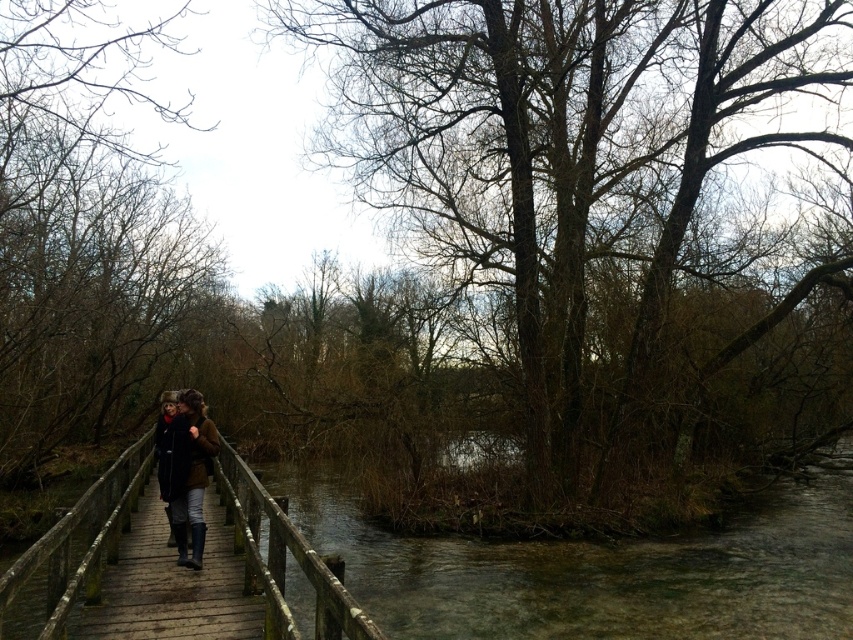
You are a hiker wearing a brown leather jacket at center and need to cross the wooden planks at center. Can you safely walk across them given their width?

The wooden planks at center has a lesser width compared to brown leather jacket at center, so it may be difficult to walk across safely as the planks are narrower than the jacket width.

You are a photographer trying to capture a detailed shot of both the wooden planks at center and the black leather coat at center from the same angle. Which object will appear narrower in your photo?

The wooden planks at center will appear narrower in the photo because it is thinner than the black leather coat at center.